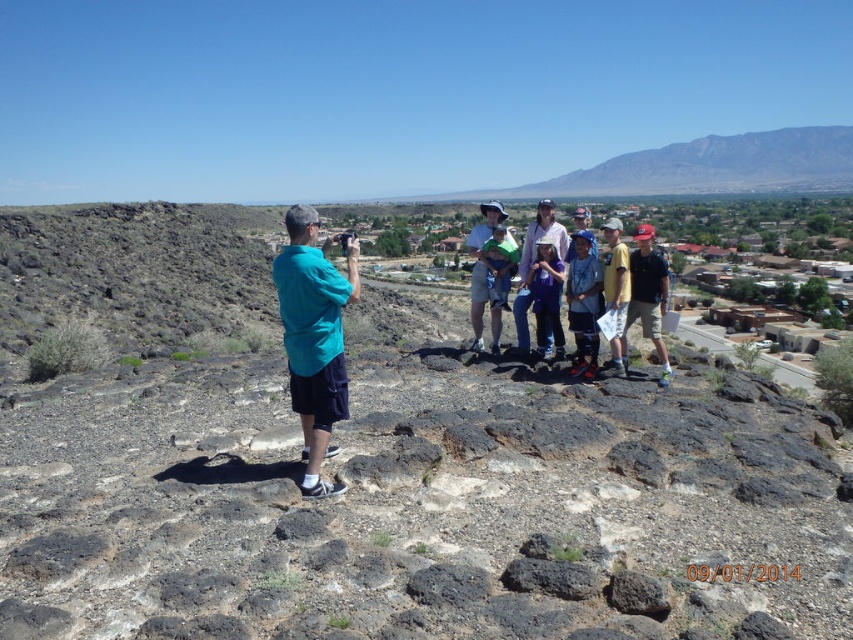
Can you confirm if green fabric shirt at center is thinner than purple cotton shirt at center?

No.

Is point (473, 230) positioned before point (515, 320)?

No.

Locate an element on the screen. Image resolution: width=853 pixels, height=640 pixels. green fabric shirt at center is located at coordinates (483, 276).

Who is shorter, matte blue shirt at right or green fabric shirt at center?

With less height is matte blue shirt at right.

Is matte blue shirt at right closer to camera compared to green fabric shirt at center?

Yes.

Is point (631, 316) behind point (479, 262)?

That is False.

In order to click on matte blue shirt at right in this screenshot , I will do `click(648, 294)`.

Does teal fabric shirt at left have a smaller size compared to green fabric shirt at center?

Yes, teal fabric shirt at left is smaller than green fabric shirt at center.

Who is lower down, teal fabric shirt at left or green fabric shirt at center?

Positioned lower is teal fabric shirt at left.

Locate an element on the screen. This screenshot has width=853, height=640. teal fabric shirt at left is located at coordinates (314, 339).